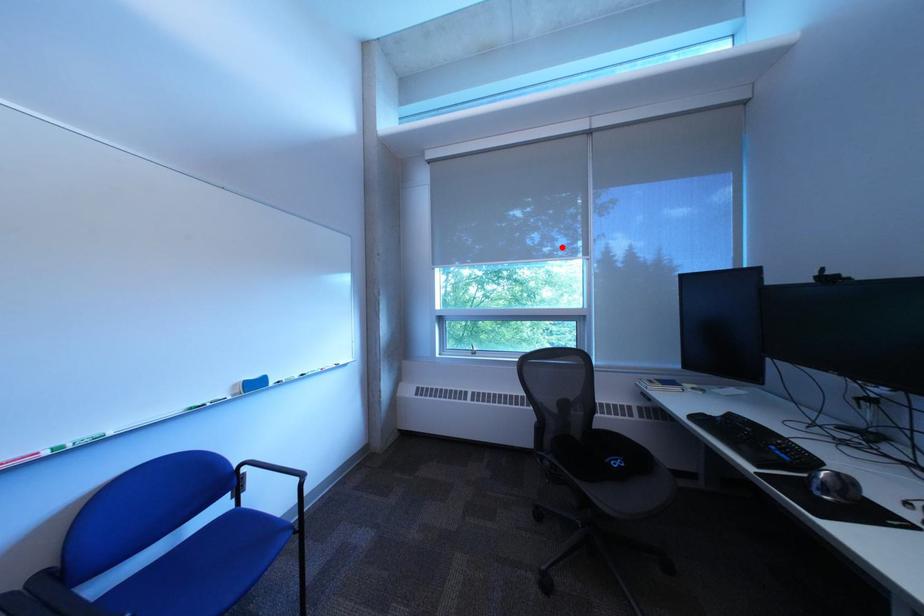
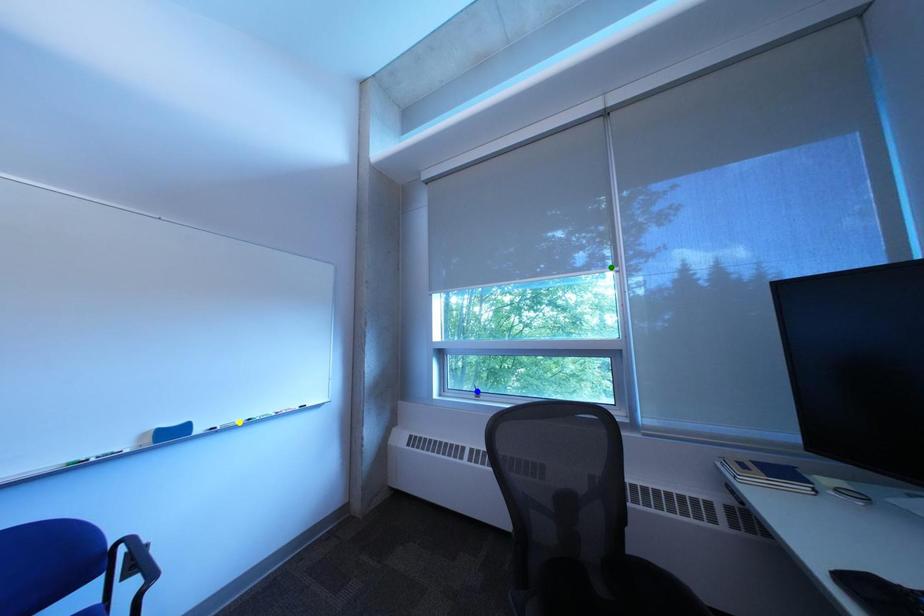
Question: I am providing you with two images of the same scene from different viewpoints. A red point is marked on the first image. You are given multiple points on the second image. Which mark in image 2 goes with the point in image 1?

Choices:
 (A) blue point
 (B) yellow point
 (C) green point

Answer: (C)